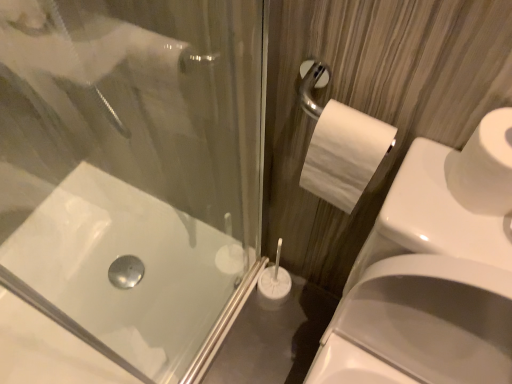
The image size is (512, 384). I want to click on free space that is to the left of white matte toilet paper at right, the 1th toilet paper in the right-to-left sequence, so click(419, 193).